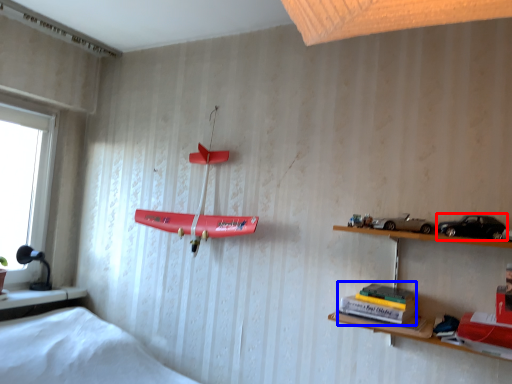
Question: Which point is further to the camera, toy car (highlighted by a red box) or book (highlighted by a blue box)?

Choices:
 (A) toy car
 (B) book

Answer: (A)